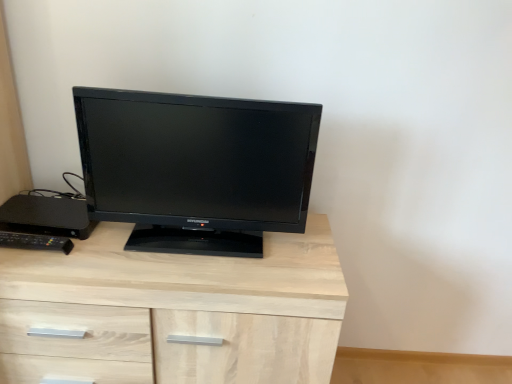
Where is `vacant space to the right of black plastic desktop at left, the second desktop in the front-to-back sequence`? vacant space to the right of black plastic desktop at left, the second desktop in the front-to-back sequence is located at coordinates (116, 240).